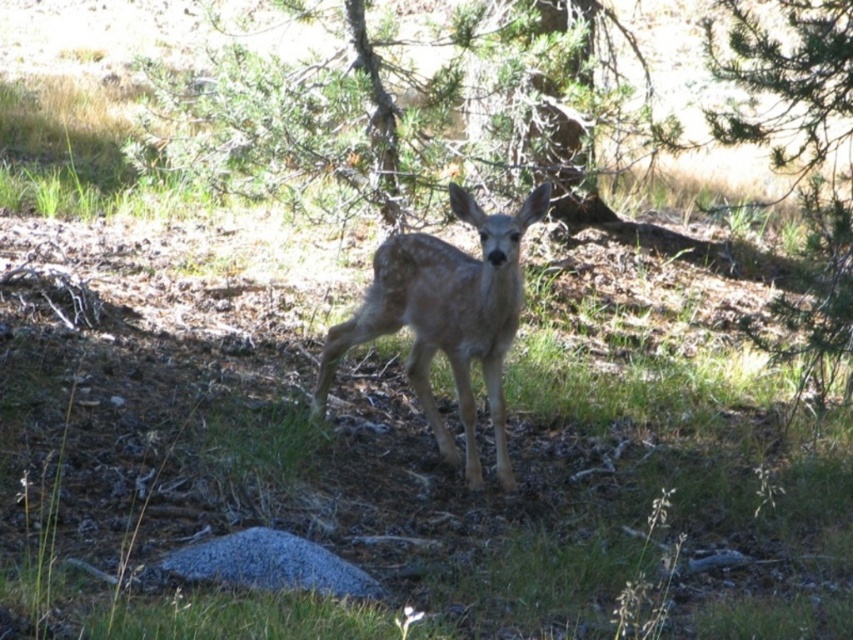
You are a hiker who wants to take a photo of the deer without disturbing it. You are currently standing at point (405, 112). There is a green textured tree at upper center located at this point. Do you think the tree will block your view of the deer?

The green textured tree at upper center is located at point (405, 112), which is where you are standing. Since the tree is at your location, it will block your view of the deer.

You are a photographer aiming to capture the fawn fur at center while ensuring the green textured tree at upper center does not block the view. Based on their positions, can you adjust your angle to avoid the tree?

The green textured tree at upper center is positioned over the fawn fur at center, so lowering your camera angle or moving to the side might help avoid the tree blocking the view.